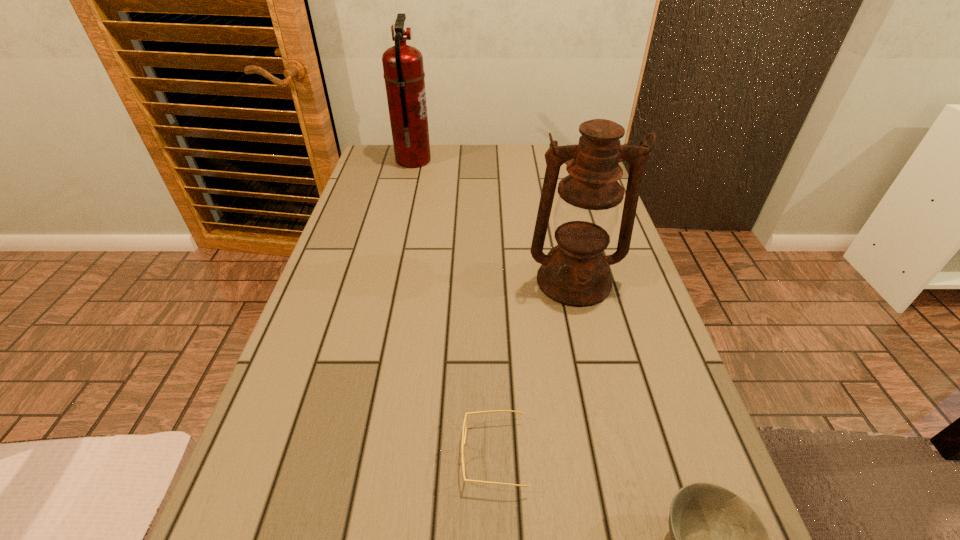
You are a GUI agent. You are given a task and a screenshot of the screen. Output one action in this format:
    pyautogui.click(x=<x>, y=<y>)
    Task: Click on the object present at the far edge
    
    Given the screenshot: What is the action you would take?
    pyautogui.click(x=403, y=68)

This screenshot has height=540, width=960. What are the coordinates of `object at the left edge` in the screenshot? It's located at (403, 68).

Identify the location of object that is positioned at the right edge. The image size is (960, 540). point(576,273).

Locate an element on the screen. This screenshot has width=960, height=540. object present at the far left corner is located at coordinates (403, 68).

In the image, there is a desktop. Find the location of `free space at the far edge`. free space at the far edge is located at coordinates (522, 150).

Locate an element on the screen. free space at the left edge of the desktop is located at coordinates (343, 329).

This screenshot has width=960, height=540. In the image, there is a desktop. Find the location of `vacant space at the right edge`. vacant space at the right edge is located at coordinates (583, 321).

At what (x,y) coordinates should I click in order to perform the action: click on free location at the far left corner. Please return your answer as a coordinate pair (x, y). The image size is (960, 540). Looking at the image, I should click on (383, 153).

Image resolution: width=960 pixels, height=540 pixels. What are the coordinates of `free space between the farthest object and the third nearest object` in the screenshot? It's located at pyautogui.click(x=493, y=221).

Find the location of a particular element. Image resolution: width=960 pixels, height=540 pixels. free space between the second object from left to right and the leftmost object is located at coordinates (454, 308).